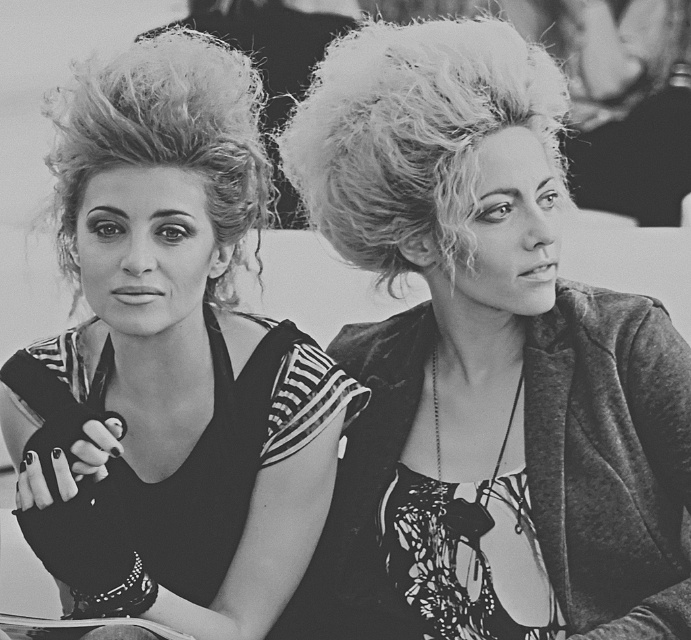
You are taking a photo of two points in the image. The first point is at coordinates point [401,100] and the second point is at point [86,461]. Which point will appear larger in your photo?

Point [401,100] is further to the camera than point [86,461], so it will appear larger in the photo.

You are a photographer adjusting the lighting for a portrait. You notice two central elements in the image, the fluffy hair at center and the matte black dress at center. Which one requires more upward adjustment of the light source to avoid shadows?

The fluffy hair at center requires more upward adjustment of the light source because it is not as tall as the matte black dress at center, so raising the light source will help reduce shadows on its lower areas.

You are an artist trying to sketch this scene. You need to focus on the area around point (484, 360). What object should you pay attention to in that area?

The fluffy hair at center is located at point (484, 360), so you should focus on drawing the fluffy hair at center in that area.